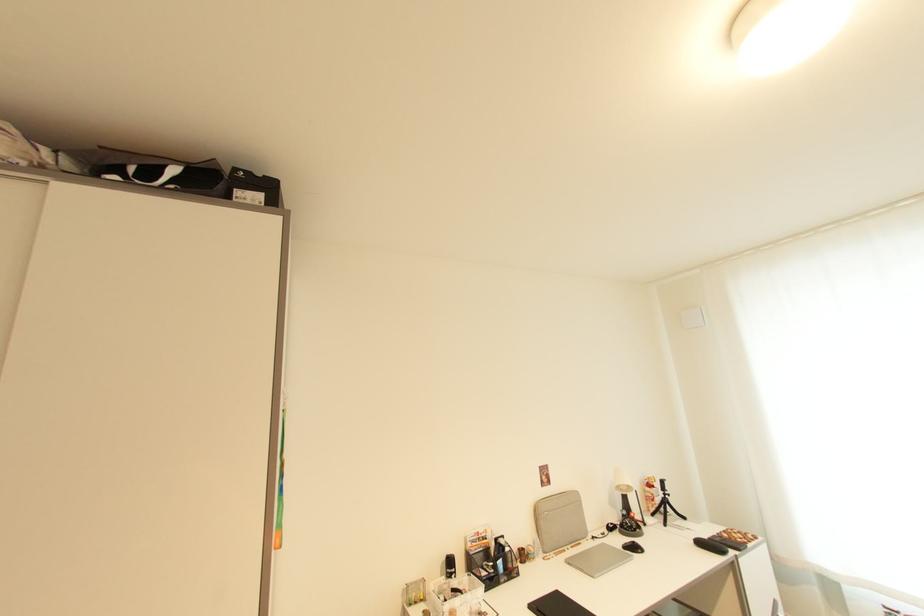
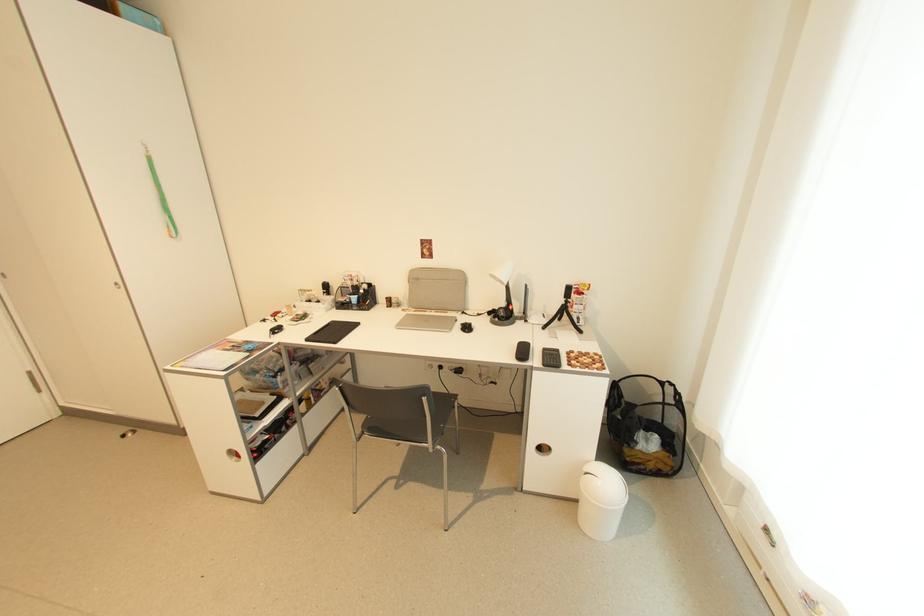
In the second image, find the point that corresponds to the point at 670,496 in the first image.

(572, 302)